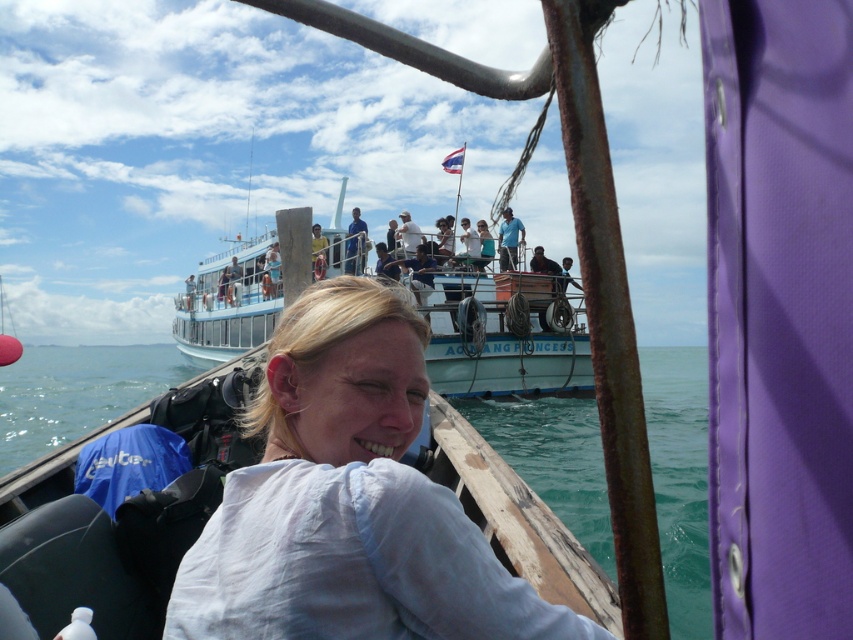
You are standing on the deck of the ferry labeled ANG PRINCESS and want to take a photo of the small wooden boat with the purple fabric. You notice two points marked on your camera screen at coordinates point (267, 369) and point (212, 280). Which point should you focus on to ensure the boat is in sharp focus?

You should focus on point (267, 369) because it is closer to the viewer than point (212, 280), ensuring the boat is in sharp focus.

You are a photographer standing on the deck of the ferry ANG PRINCESS. You see the white glossy boat at upper center and the blue shirt at upper center in your camera viewfinder. Which object appears taller in the photo?

The white glossy boat at upper center appears taller in the photo because it has a greater height compared to the blue shirt at upper center.